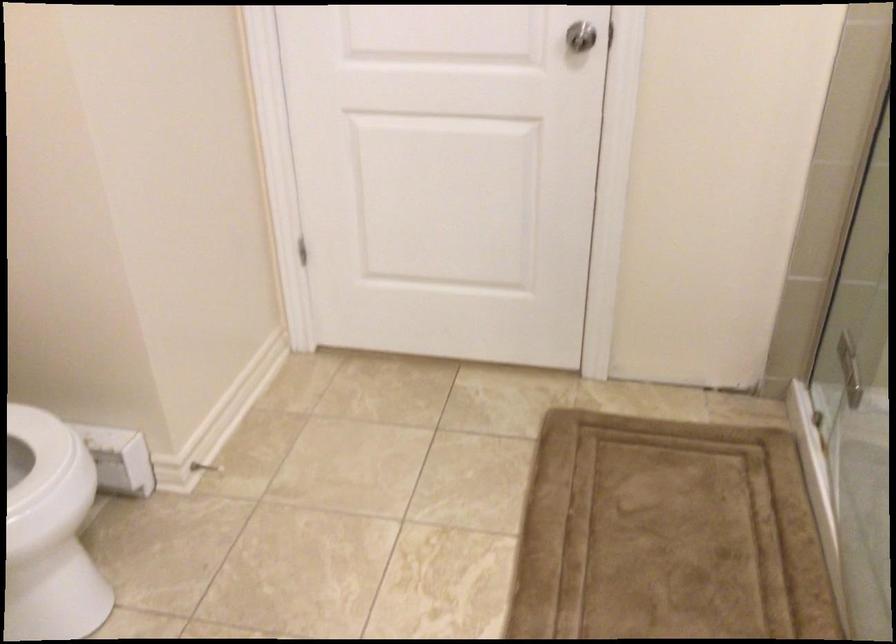
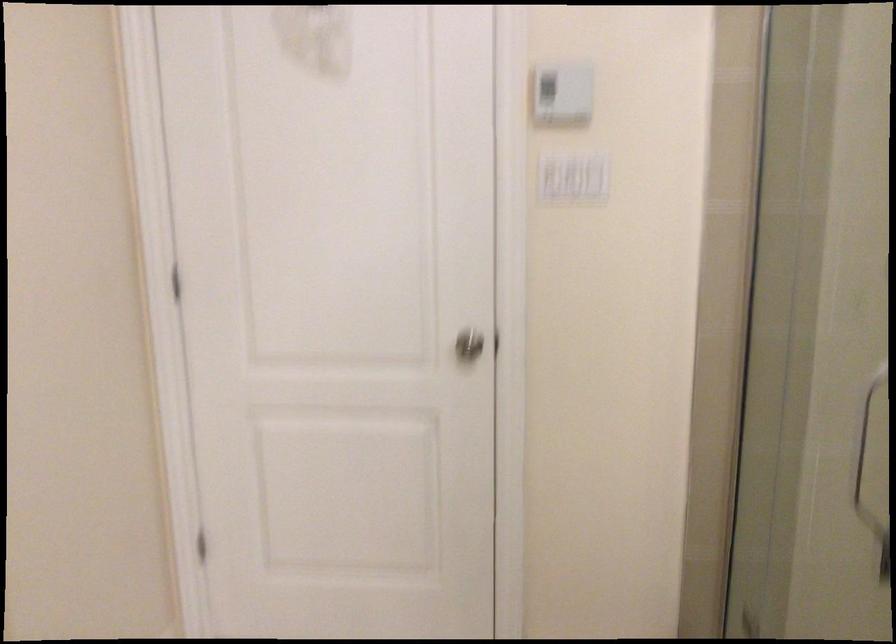
Question: How did the camera likely rotate?

Choices:
 (A) Left
 (B) Right
 (C) Up
 (D) Down

Answer: (C)